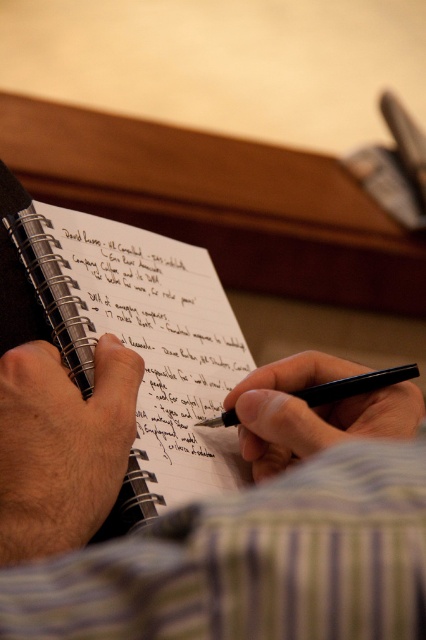
Question: In this image, where is spiral-bound paper at center located relative to black metallic pen at center?

Choices:
 (A) above
 (B) below

Answer: (A)

Question: Does striped fabric shirt at center have a greater width compared to smooth skin hand at center?

Choices:
 (A) yes
 (B) no

Answer: (A)

Question: Which object appears farthest from the camera in this image?

Choices:
 (A) striped fabric shirt at center
 (B) black smooth pen at center
 (C) smooth skin hand at center
 (D) spiral-bound paper at center

Answer: (D)

Question: Can you confirm if black smooth pen at center is positioned above black metallic pen at center?

Choices:
 (A) no
 (B) yes

Answer: (A)

Question: Which point is farther to the camera?

Choices:
 (A) [49, 355]
 (B) [279, 436]
 (C) [296, 580]

Answer: (B)

Question: Among these points, which one is nearest to the camera?

Choices:
 (A) (58, 472)
 (B) (212, 396)
 (C) (273, 624)
 (D) (298, 396)

Answer: (C)